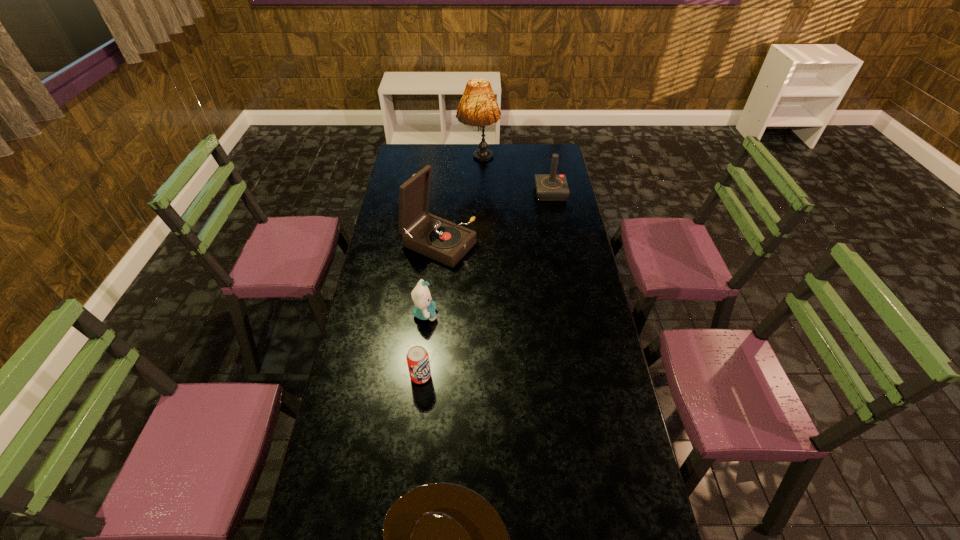
You are a GUI agent. You are given a task and a screenshot of the screen. Output one action in this format:
    pyautogui.click(x=<x>, y=<y>)
    Task: Click on the farthest object
    The image size is (960, 540).
    Given the screenshot: What is the action you would take?
    pyautogui.click(x=478, y=107)

Identify the location of the tallest object. This screenshot has height=540, width=960. (478, 107).

Find the location of a particular element. The height and width of the screenshot is (540, 960). phonograph record is located at coordinates (439, 239).

At what (x,y) coordinates should I click in order to perform the action: click on the second tallest object. Please return your answer as a coordinate pair (x, y). Looking at the image, I should click on (439, 239).

The image size is (960, 540). I want to click on joystick, so click(549, 187).

Where is `the third tallest object`? This screenshot has width=960, height=540. the third tallest object is located at coordinates (549, 187).

The height and width of the screenshot is (540, 960). In order to click on kitten in this screenshot , I will do point(424,309).

Where is `soda can`? The image size is (960, 540). soda can is located at coordinates (417, 357).

The width and height of the screenshot is (960, 540). What are the coordinates of `free space located on the front-facing side of the farthest object` in the screenshot? It's located at (478, 201).

Find the location of a particular element. vacant space located on the back of the third farthest object is located at coordinates (444, 187).